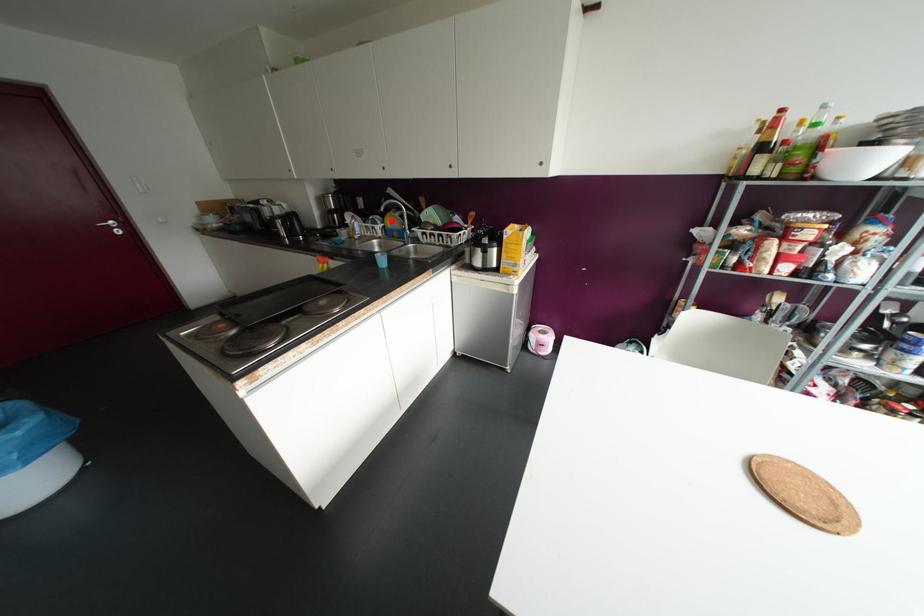
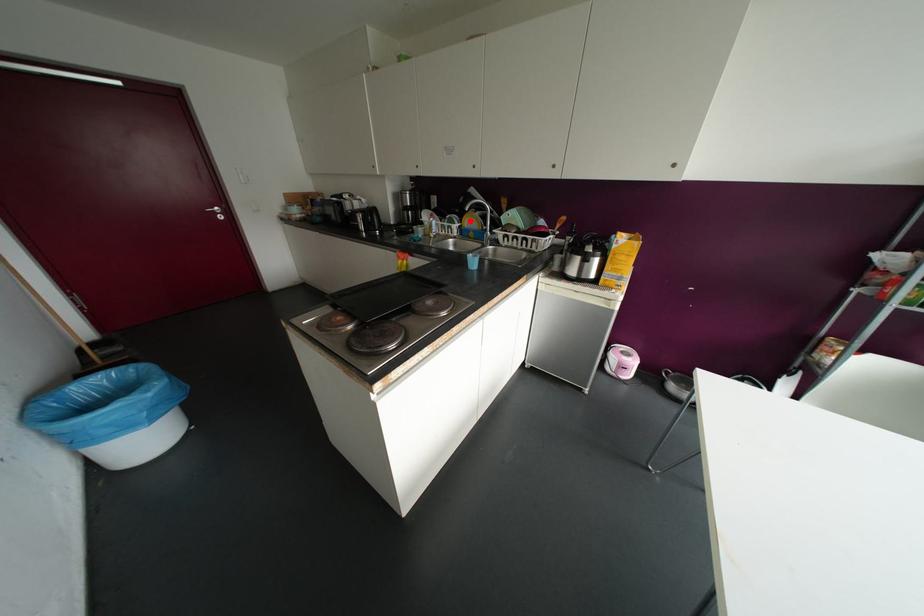
I am providing you with two images of the same scene from different viewpoints. A red point is marked on the first image and another point is marked on the second image. Is the marked point in image1 the same physical position as the marked point in image2?

Yes